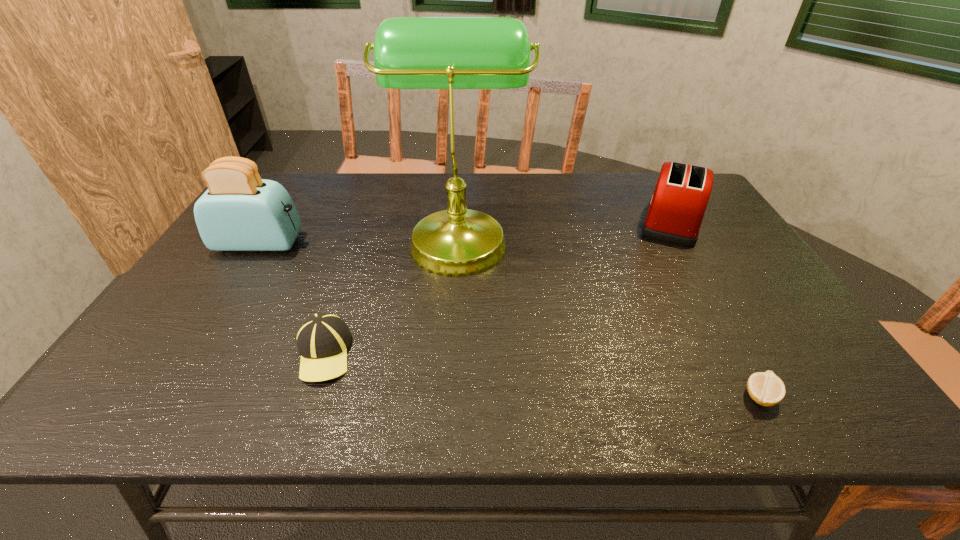
The width and height of the screenshot is (960, 540). Find the location of `unoccupied position between the shortest object and the third object from left to right`. unoccupied position between the shortest object and the third object from left to right is located at coordinates (610, 317).

Where is `vacant area that lies between the shortest object and the fourth tallest object`? Image resolution: width=960 pixels, height=540 pixels. vacant area that lies between the shortest object and the fourth tallest object is located at coordinates (541, 374).

What are the coordinates of `free space between the leftmost object and the second object from left to right` in the screenshot? It's located at (292, 298).

Identify the location of free spot between the lemon and the tallest object. This screenshot has height=540, width=960. pyautogui.click(x=610, y=317).

In order to click on free space between the second shortest object and the fourth shortest object in this screenshot , I will do `click(292, 298)`.

The width and height of the screenshot is (960, 540). In order to click on vacant space in between the lamp and the right toaster in this screenshot , I will do `click(564, 230)`.

Find the location of `free spot between the taller toaster and the baseball cap`. free spot between the taller toaster and the baseball cap is located at coordinates (292, 298).

Locate an element on the screen. The height and width of the screenshot is (540, 960). object that is the fourth closest to the second shortest object is located at coordinates (676, 209).

Identify which object is the third closest to the fourth shortest object. Please provide its 2D coordinates. Your answer should be formatted as a tuple, i.e. [(x, y)], where the tuple contains the x and y coordinates of a point satisfying the conditions above.

[(676, 209)]

The height and width of the screenshot is (540, 960). Find the location of `vacant space that satisfies the following two spatial constraints: 1. on the desk next to the lamp; 2. with the brim of the baseball cap facing forward`. vacant space that satisfies the following two spatial constraints: 1. on the desk next to the lamp; 2. with the brim of the baseball cap facing forward is located at coordinates (451, 353).